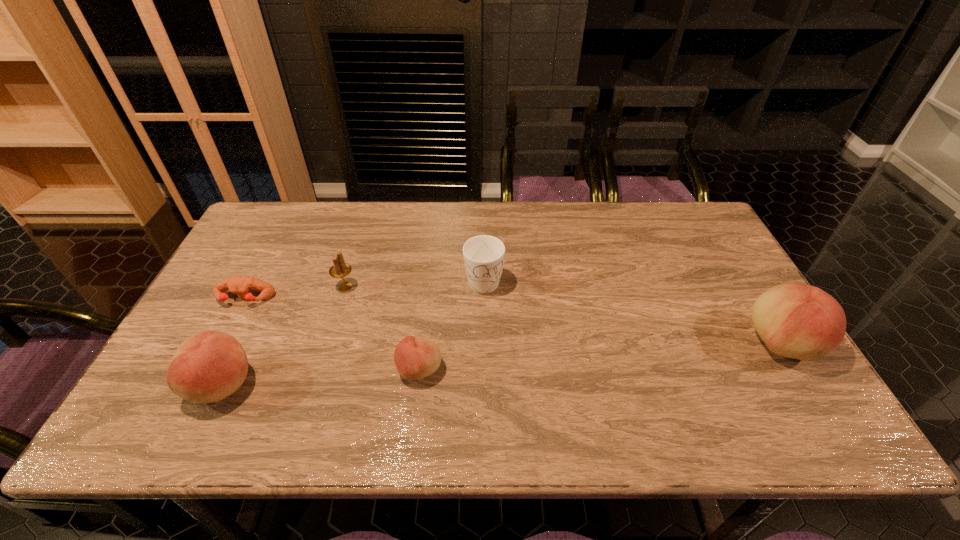
In order to click on vacant space at the right edge of the desktop in this screenshot , I will do `click(728, 276)`.

Locate an element on the screen. blank space at the far left corner of the desktop is located at coordinates click(x=263, y=220).

This screenshot has width=960, height=540. I want to click on vacant space that's between the mug and the rightmost object, so click(x=633, y=311).

Locate an element on the screen. The width and height of the screenshot is (960, 540). vacant space in between the second object from right to left and the puncher is located at coordinates (364, 289).

Identify the location of free area in between the puncher and the mug. (364, 289).

You are a GUI agent. You are given a task and a screenshot of the screen. Output one action in this format:
    pyautogui.click(x=<x>, y=<y>)
    Task: Click on the vacant point located between the fifth object from left to right and the candle holder
    
    Given the screenshot: What is the action you would take?
    pyautogui.click(x=415, y=283)

This screenshot has height=540, width=960. What are the coordinates of `free area in between the leftmost peach and the rightmost object` in the screenshot? It's located at (502, 363).

The image size is (960, 540). Identify the location of vacant space in between the third object from right to left and the second object from right to left. (451, 325).

Locate an element on the screen. This screenshot has width=960, height=540. vacant area that lies between the third object from left to right and the puncher is located at coordinates (295, 293).

The height and width of the screenshot is (540, 960). Find the location of `free spot between the fifth object from left to right and the rightmost object`. free spot between the fifth object from left to right and the rightmost object is located at coordinates (633, 311).